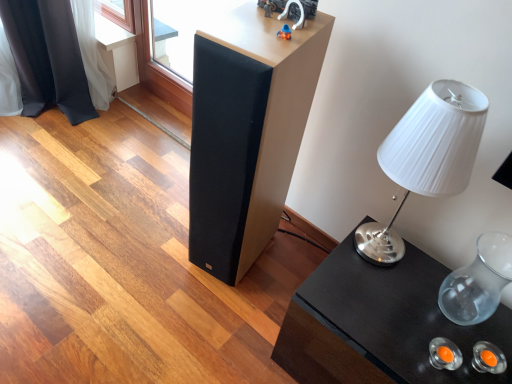
Locate an element on the screen. vacant area located to the right-hand side of white pleated fabric lampshade at right is located at coordinates (433, 282).